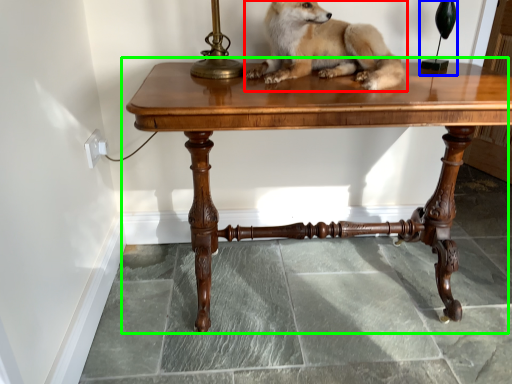
Question: Which object is the closest to the dog (highlighted by a red box)? Choose among these: table lamp (highlighted by a blue box) or table (highlighted by a green box).

Choices:
 (A) table lamp
 (B) table

Answer: (B)